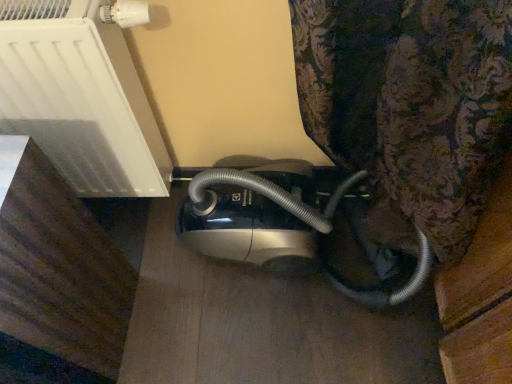
The height and width of the screenshot is (384, 512). Identify the location of vacant region below satin silver vacuum cleaner at lower center (from a real-world perspective). (152, 206).